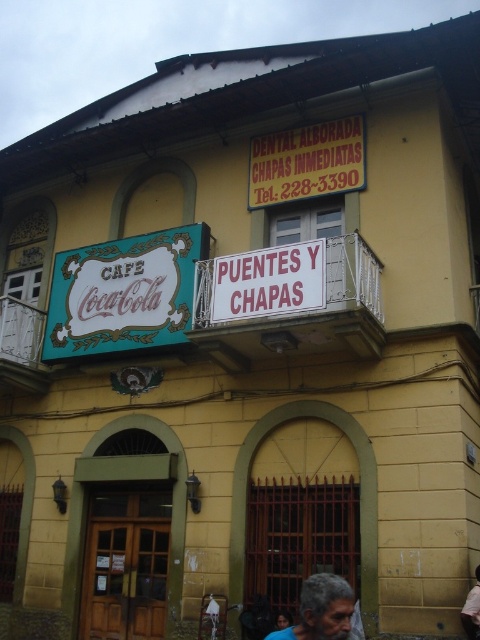
Question: Which point is closer to the camera?

Choices:
 (A) (472, 605)
 (B) (96, 273)
 (C) (204, 268)
 (D) (15, 339)

Answer: (A)

Question: Considering the real-world distances, which object is farthest from the yellow plastic sign at upper center?

Choices:
 (A) gray hair at lower center
 (B) white metal balcony at upper center
 (C) teal glossy signboard at upper left
 (D) light brown skin at lower right

Answer: (D)

Question: Where is gray hair at lower center located in relation to light brown skin at lower right in the image?

Choices:
 (A) above
 (B) below

Answer: (A)

Question: Which object is farther from the camera taking this photo?

Choices:
 (A) white metal balcony at upper center
 (B) yellow plastic sign at upper center
 (C) light brown skin at lower right
 (D) white painted wood at upper left

Answer: (D)

Question: Is the position of yellow plastic sign at upper center less distant than that of white painted wood at upper left?

Choices:
 (A) no
 (B) yes

Answer: (B)

Question: Is the position of white metal balcony at upper center more distant than that of light brown skin at lower right?

Choices:
 (A) yes
 (B) no

Answer: (A)